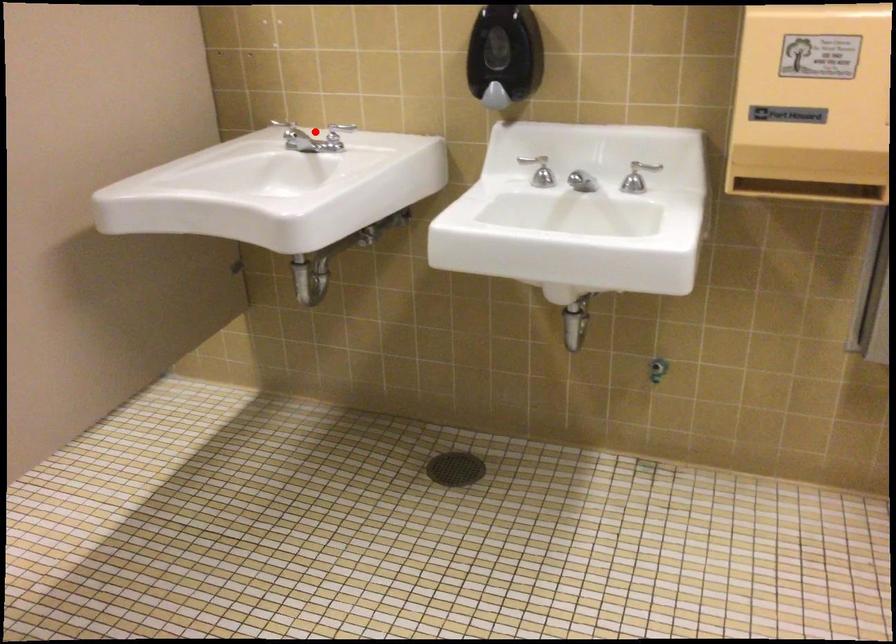
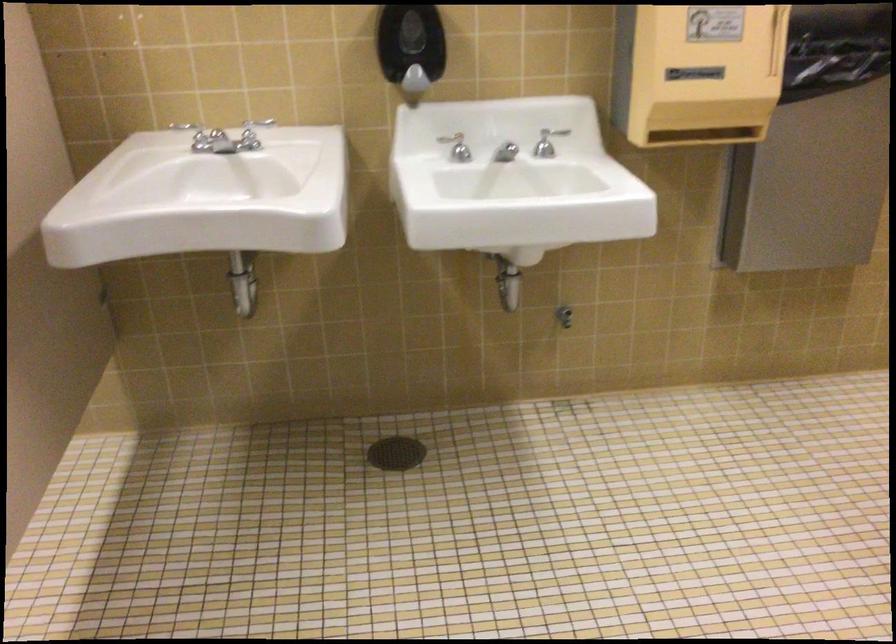
Find the pixel in the second image that matches the highlighted location in the first image.

(194, 135)